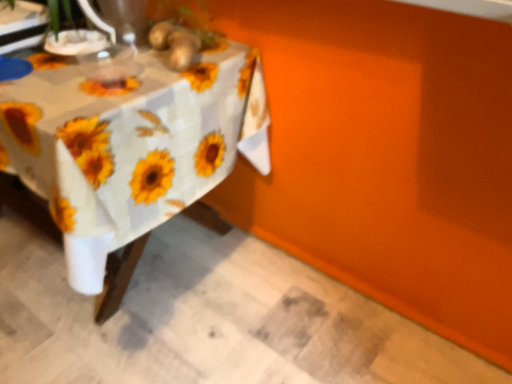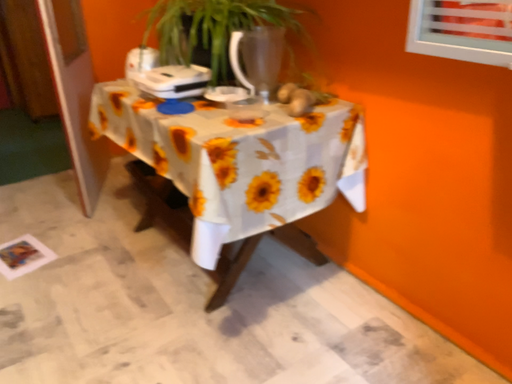
Question: How did the camera likely rotate when shooting the video?

Choices:
 (A) rotated right
 (B) rotated left

Answer: (B)